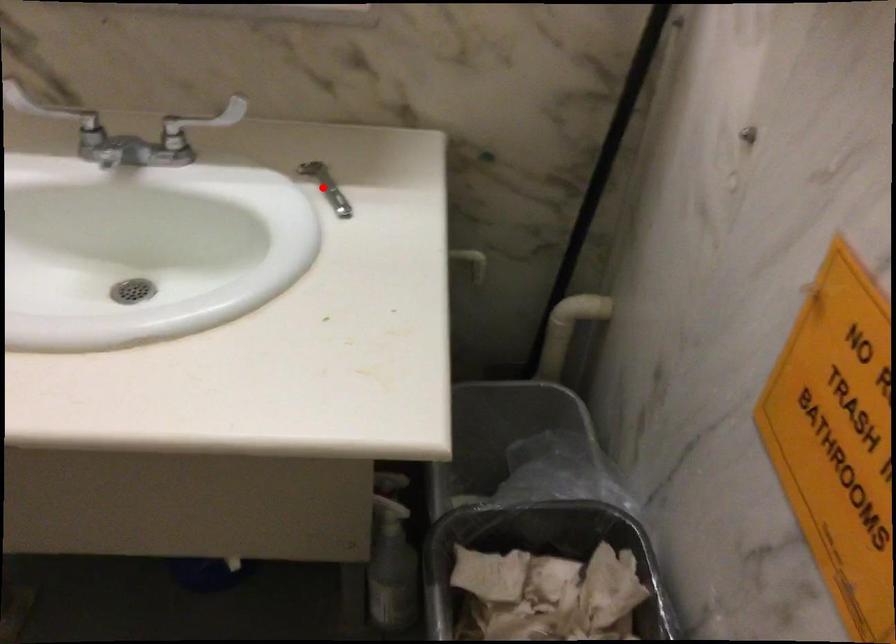
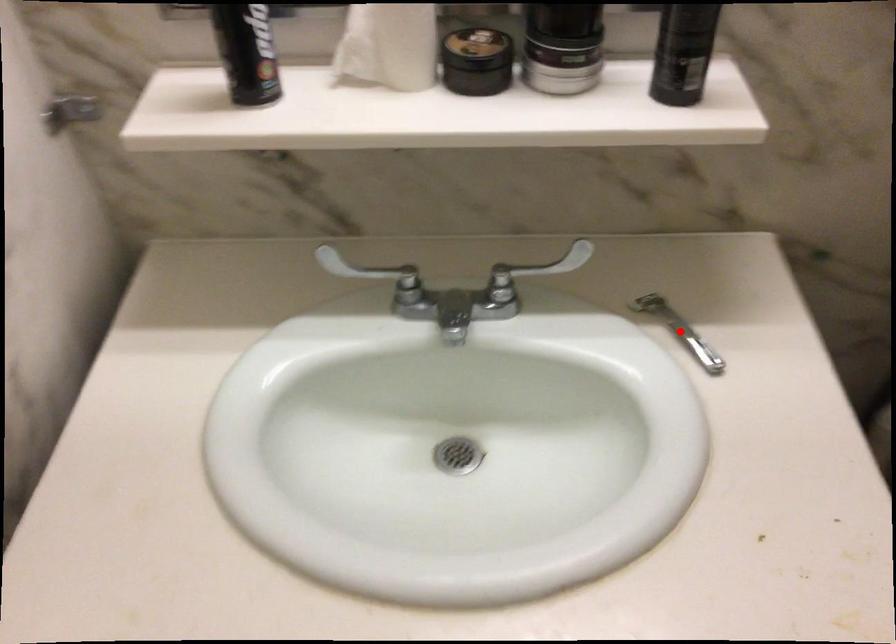
I am providing you with two images of the same scene from different viewpoints. A red point is marked on the first image and another point is marked on the second image. Do the highlighted points in image1 and image2 indicate the same real-world spot?

Yes